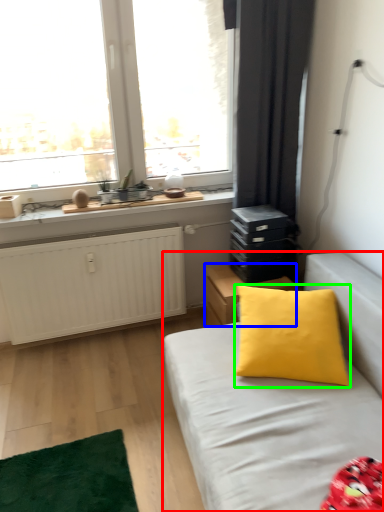
Question: Based on their relative distances, which object is nearer to studio couch (highlighted by a red box)? Choose from nightstand (highlighted by a blue box) and pillow (highlighted by a green box).

Choices:
 (A) nightstand
 (B) pillow

Answer: (B)